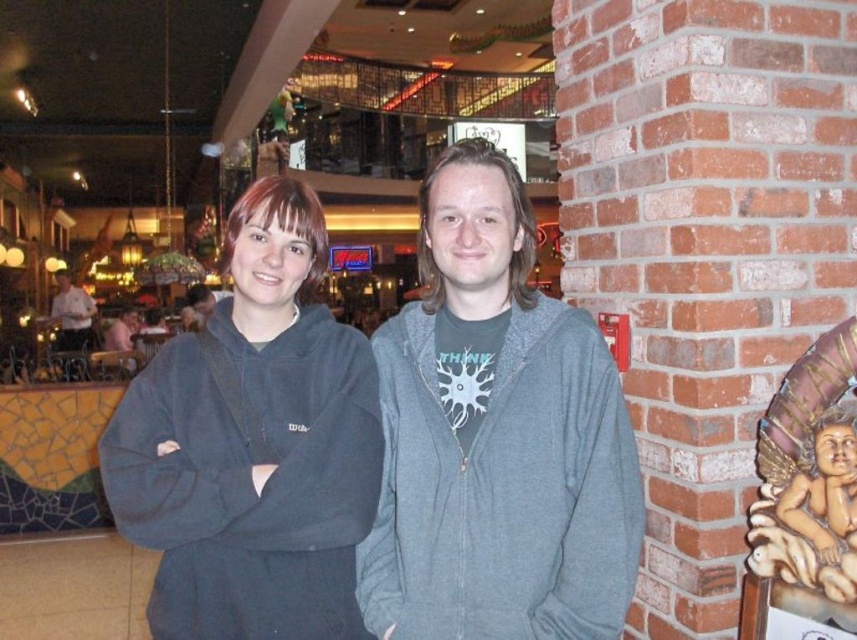
You are standing at the origin of a coordinate system placed at the bottom left corner of the image. A point is marked at coordinates (496, 436). Which object does this point correspond to?

The point at (496, 436) corresponds to the dark gray sweatshirt at center.

You are taking a photo of the two people in the scene. You want to focus on the person closer to the camera. Which point should you focus on, point (268, 509) or point (379, 573)?

Point (268, 509) is closer to the camera than point (379, 573), so you should focus on point (268, 509) to capture the person closer to the camera.

You are a tailor measuring two sweatshirts for alterations. The dark gray sweatshirt at center and the gray fleece sweatshirt at center are both on a table in front of you. Which sweatshirt has a larger width?

The dark gray sweatshirt at center has a larger width than the gray fleece sweatshirt at center according to the description.